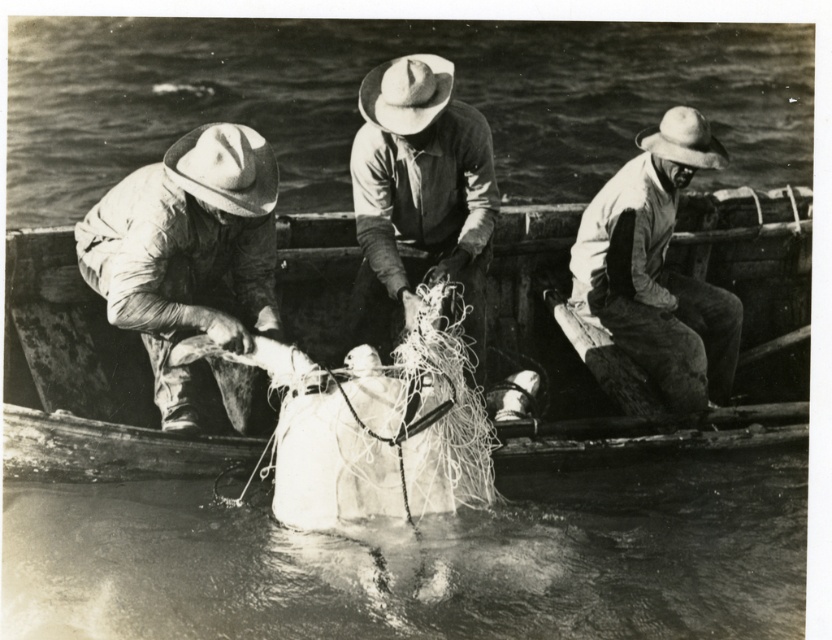
Question: Which point is farther to the camera?

Choices:
 (A) white cotton shirt at right
 (B) rough fabric hat at center

Answer: (A)

Question: Which object is positioned closest to the white cotton shirt at right?

Choices:
 (A) matte white shirt at left
 (B) rough fabric hat at center
 (C) wooden boat at center

Answer: (C)

Question: Does matte white shirt at left come behind rough fabric hat at center?

Choices:
 (A) yes
 (B) no

Answer: (B)

Question: Observing the image, what is the correct spatial positioning of white cotton shirt at right in reference to rough fabric hat at center?

Choices:
 (A) below
 (B) above

Answer: (A)

Question: Is wooden boat at center behind white cotton shirt at right?

Choices:
 (A) no
 (B) yes

Answer: (B)

Question: Which of the following is the farthest from the observer?

Choices:
 (A) wooden boat at center
 (B) rough fabric hat at center
 (C) white cotton shirt at right

Answer: (A)